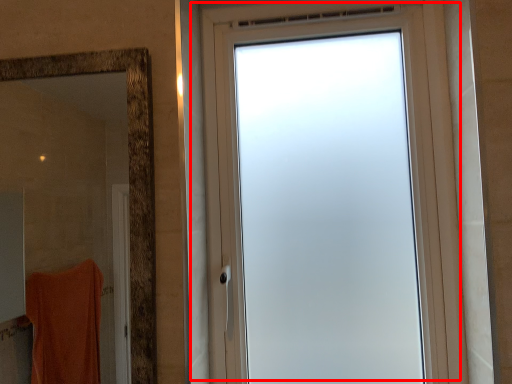
Question: Observing the image, what is the correct spatial positioning of window (annotated by the red box) in reference to mirror?

Choices:
 (A) right
 (B) left

Answer: (A)